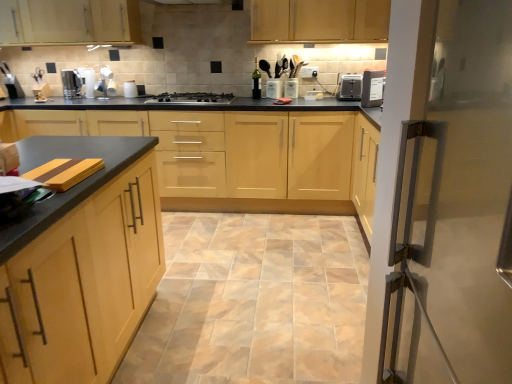
Question: Is satin silver kettle at left not near matte wood cabinets at upper center, which is the 3th cabinetry in front-to-back order?

Choices:
 (A) yes
 (B) no

Answer: (A)

Question: Considering the relative sizes of satin silver kettle at left and matte wood cabinets at upper center, the second cabinetry positioned from the back, in the image provided, is satin silver kettle at left shorter than matte wood cabinets at upper center, the second cabinetry positioned from the back,?

Choices:
 (A) no
 (B) yes

Answer: (B)

Question: Is matte wood cabinets at upper center, which is the third cabinetry from bottom to top, a part of satin silver kettle at left?

Choices:
 (A) no
 (B) yes

Answer: (A)

Question: Is satin silver kettle at left oriented towards matte wood cabinets at upper center, the second cabinetry positioned from the back?

Choices:
 (A) yes
 (B) no

Answer: (B)

Question: Can you confirm if satin silver kettle at left is positioned to the left of matte wood cabinets at upper center, which is the third cabinetry from bottom to top?

Choices:
 (A) yes
 (B) no

Answer: (A)

Question: From a real-world perspective, is beige ceramic tile at center above or below black plastic toaster at upper right?

Choices:
 (A) below
 (B) above

Answer: (A)

Question: In the image, is beige ceramic tile at center on the left side or the right side of black plastic toaster at upper right?

Choices:
 (A) left
 (B) right

Answer: (A)

Question: Is point coord(197,289) positioned closer to the camera than point coord(340,79)?

Choices:
 (A) farther
 (B) closer

Answer: (B)

Question: Is beige ceramic tile at center bigger or smaller than black plastic toaster at upper right?

Choices:
 (A) big
 (B) small

Answer: (A)

Question: Considering the positions of point (179, 96) and point (109, 360), is point (179, 96) closer or farther from the camera than point (109, 360)?

Choices:
 (A) closer
 (B) farther

Answer: (B)

Question: In terms of width, does stainless steel gas stove at center look wider or thinner when compared to matte wood cabinet at left, which is the fourth cabinetry from top to bottom?

Choices:
 (A) thin
 (B) wide

Answer: (A)

Question: Considering the relative positions of stainless steel gas stove at center and matte wood cabinet at left, the first cabinetry when ordered from bottom to top, in the image provided, is stainless steel gas stove at center to the left or to the right of matte wood cabinet at left, the first cabinetry when ordered from bottom to top,?

Choices:
 (A) right
 (B) left

Answer: (A)

Question: Considering the positions of stainless steel gas stove at center and matte wood cabinet at left, the first cabinetry when ordered from bottom to top, in the image, is stainless steel gas stove at center taller or shorter than matte wood cabinet at left, the first cabinetry when ordered from bottom to top,?

Choices:
 (A) tall
 (B) short

Answer: (B)

Question: From a real-world perspective, relative to matte wood cabinets at upper center, the second cabinetry positioned from the back, is light wood/veneer cabinets at center, which is counted as the second cabinetry, starting from the bottom, vertically above or below?

Choices:
 (A) below
 (B) above

Answer: (A)

Question: Is light wood/veneer cabinets at center, the 2th cabinetry in the front-to-back sequence, taller or shorter than matte wood cabinets at upper center, the 2th cabinetry viewed from the top?

Choices:
 (A) tall
 (B) short

Answer: (A)